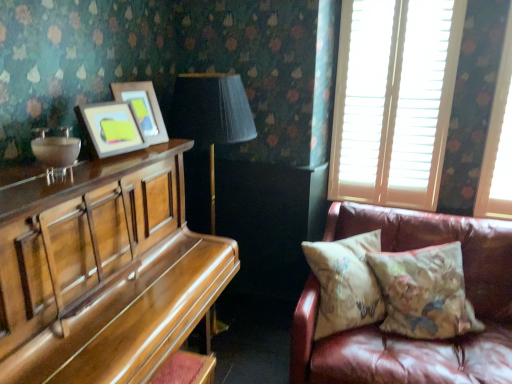
Question: In the image, is shiny brown piano at left on the left side or the right side of leather couch at right?

Choices:
 (A) left
 (B) right

Answer: (A)

Question: From the image's perspective, is shiny brown piano at left located above or below leather couch at right?

Choices:
 (A) above
 (B) below

Answer: (A)

Question: Which object is the closest to the shiny brown piano at left?

Choices:
 (A) floral-patterned fabric pillow at right, which appears as the 1th pillow when viewed from the left
 (B) leather couch at right
 (C) floral-patterned fabric pillow at right, positioned as the 1th pillow in right-to-left order
 (D) matte wooden picture frame at upper left, positioned as the 1th picture frame in back-to-front order
 (E) matte wooden picture frame at upper left, which is the 2th picture frame from back to front

Answer: (E)

Question: Which is nearer to the floral-patterned fabric pillow at right, marked as the 2th pillow in a left-to-right arrangement?

Choices:
 (A) floral-patterned fabric pillow at right, which appears as the 1th pillow when viewed from the left
 (B) white wooden blinds at upper right
 (C) matte wooden picture frame at upper left, the second picture frame in the front-to-back sequence
 (D) leather couch at right
 (E) matte wooden picture frame at upper left, the 1th picture frame in the front-to-back sequence

Answer: (D)